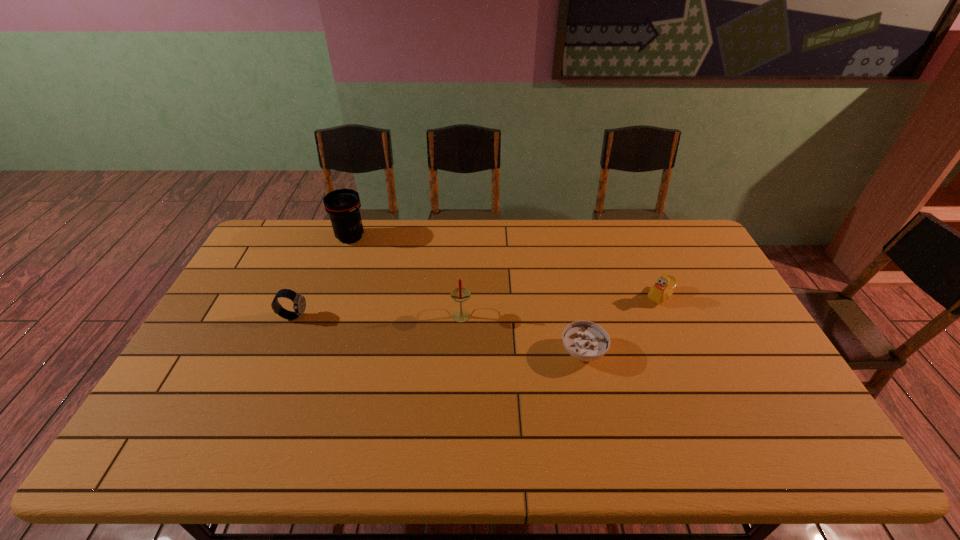
The height and width of the screenshot is (540, 960). Identify the location of free region that satisfies the following two spatial constraints: 1. on the face of the watch; 2. on the right side of the soup bowl. (278, 352).